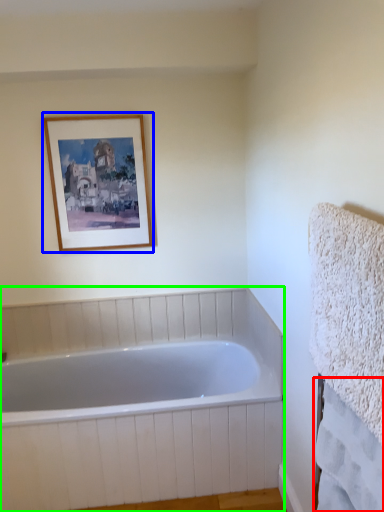
Question: Which is nearer to the bath towel (highlighted by a red box)? picture frame (highlighted by a blue box) or bathtub (highlighted by a green box).

Choices:
 (A) picture frame
 (B) bathtub

Answer: (B)